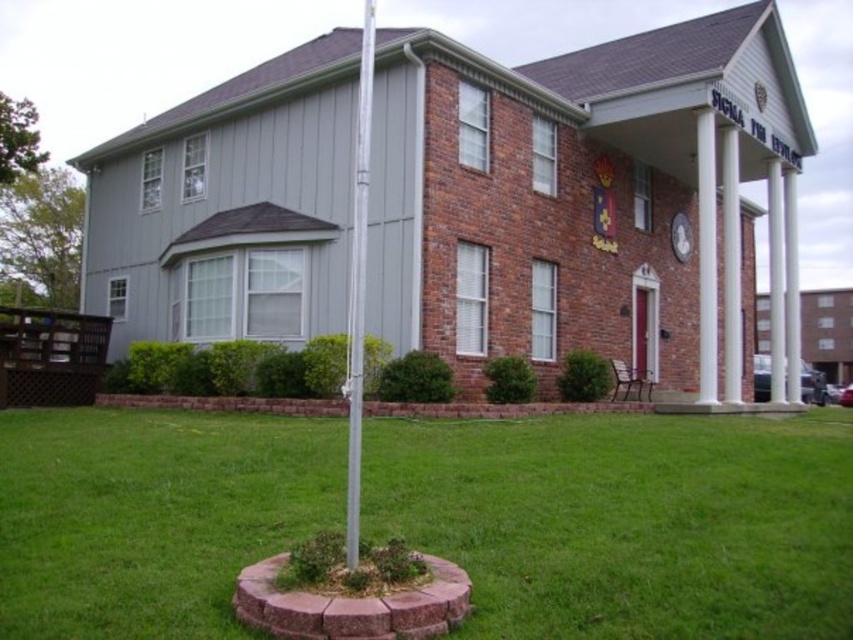
Is white marble pillar at right positioned before white smooth pillar at right?

Yes, white marble pillar at right is in front of white smooth pillar at right.

How much distance is there between white marble pillar at right and white smooth pillar at right?

A distance of 7.00 meters exists between white marble pillar at right and white smooth pillar at right.

Does point (701, 362) lie behind point (785, 337)?

No.

The height and width of the screenshot is (640, 853). What are the coordinates of `white marble pillar at right` in the screenshot? It's located at (706, 257).

Can you confirm if white smooth column at center is smaller than white glossy pillar at center?

Yes, white smooth column at center is smaller than white glossy pillar at center.

Which is below, white smooth column at center or white glossy pillar at center?

white smooth column at center

Image resolution: width=853 pixels, height=640 pixels. I want to click on white smooth column at center, so click(730, 268).

Find the location of a particular element. The height and width of the screenshot is (640, 853). white smooth column at center is located at coordinates (730, 268).

Who is more forward, (668, 448) or (358, 429)?

Point (358, 429)

Does point (561, 630) lie behind point (352, 220)?

No, (561, 630) is closer to viewer.

The height and width of the screenshot is (640, 853). I want to click on green grass at center, so click(627, 522).